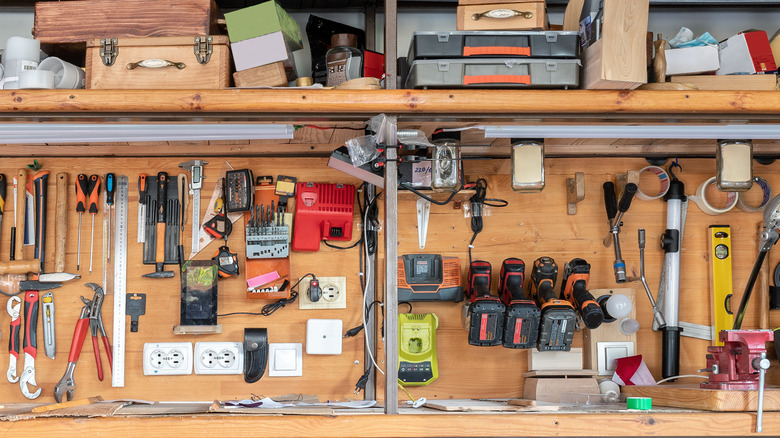
This screenshot has height=438, width=780. In order to click on electric outlets in this screenshot , I will do `click(151, 357)`, `click(174, 361)`, `click(207, 357)`, `click(229, 362)`, `click(335, 289)`, `click(317, 290)`.